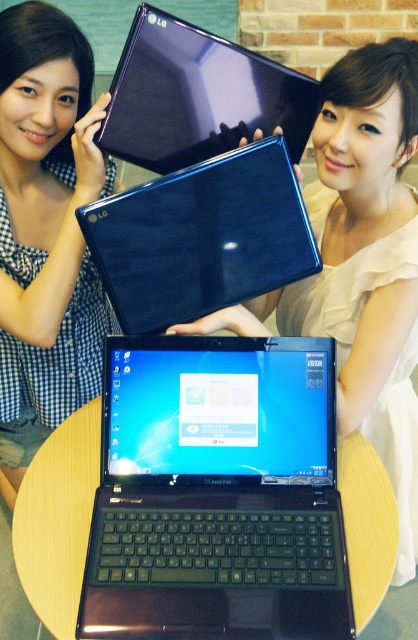
You are an event organizer at a tech conference. You need to arrange two laptops for a presentation. The laptops are the metallic blue laptop at center and the matte blue laptop at center. According to the scene, which laptop should you place on the left side to match the original display?

The metallic blue laptop at center should be placed on the left side of the matte blue laptop at center to match the original display.

You are organizing a product display and need to stack the metallic blue laptop at center and the matte blue laptop at center vertically. Which one should you place at the bottom to ensure stability?

You should place the metallic blue laptop at center at the bottom because it has a lesser height compared to the matte blue laptop at center, making it more stable as the base.